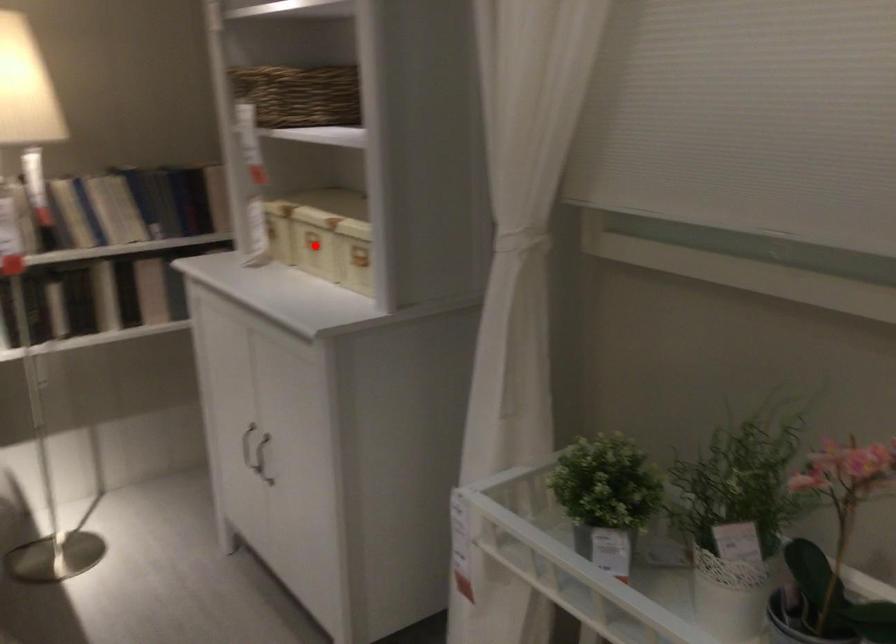
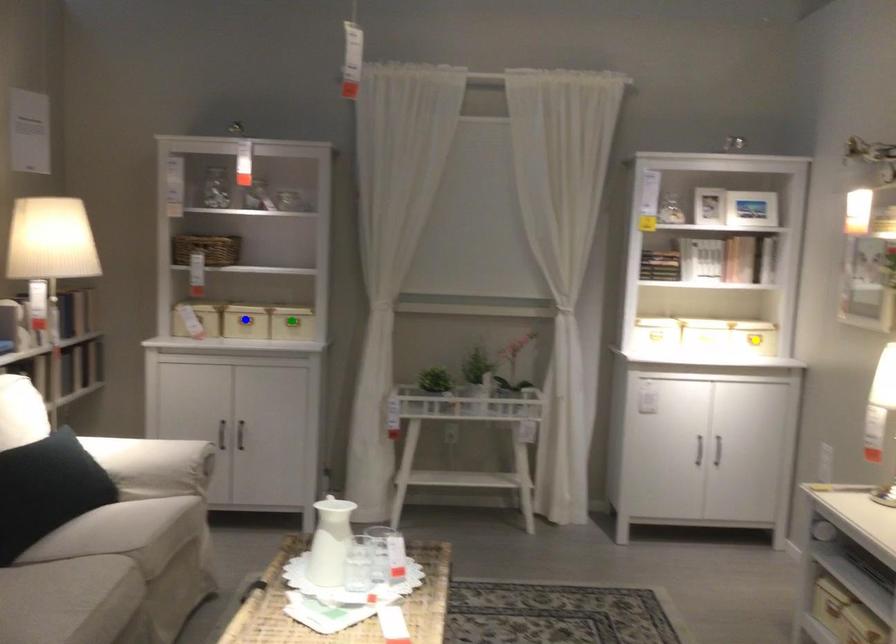
Question: I am providing you with two images of the same scene from different viewpoints. A red point is marked on the first image. You are given multiple points on the second image. Which point in image 2 represents the same 3d spot as the red point in image 1?

Choices:
 (A) green point
 (B) yellow point
 (C) blue point

Answer: (C)